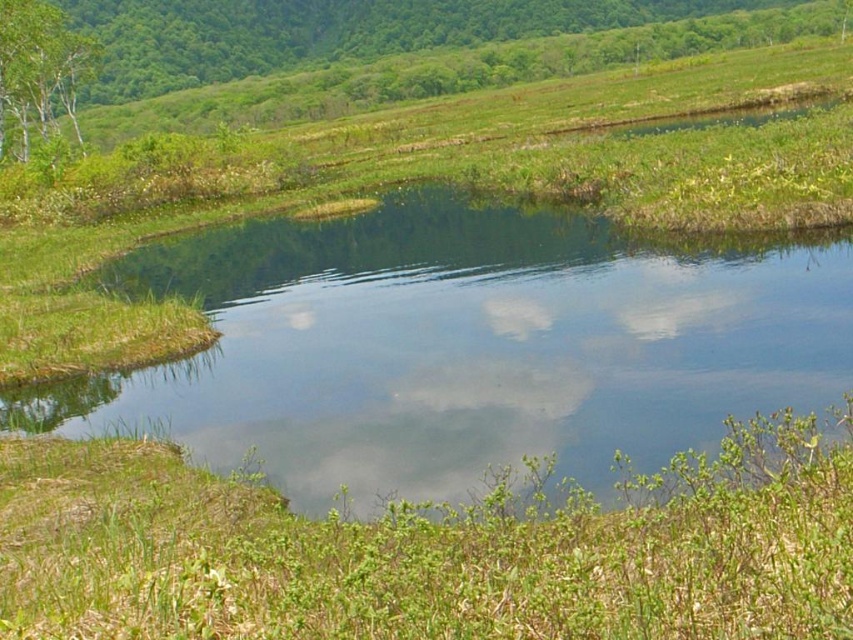
You are standing at the edge of the pond in the meadow. You notice a point labeled as point [463,346]. What is located at that point?

The point [463,346] corresponds to clear water at center.

You are standing at the edge of the pond in the meadow and notice two points in the scene. The first point is at coordinates point (258, 417), and the second is at point (450, 84). Which of these two points is closer to your current position?

Point (258, 417) is closer to the camera than point (450, 84), so the first point is closer to your current position.

You are standing in the meadow and want to cross to the other side. You see the clear water at center and the green leafy grass at lower center. Which one is larger and would require more space to navigate around?

The clear water at center is bigger than the green leafy grass at lower center, so it would require more space to navigate around.